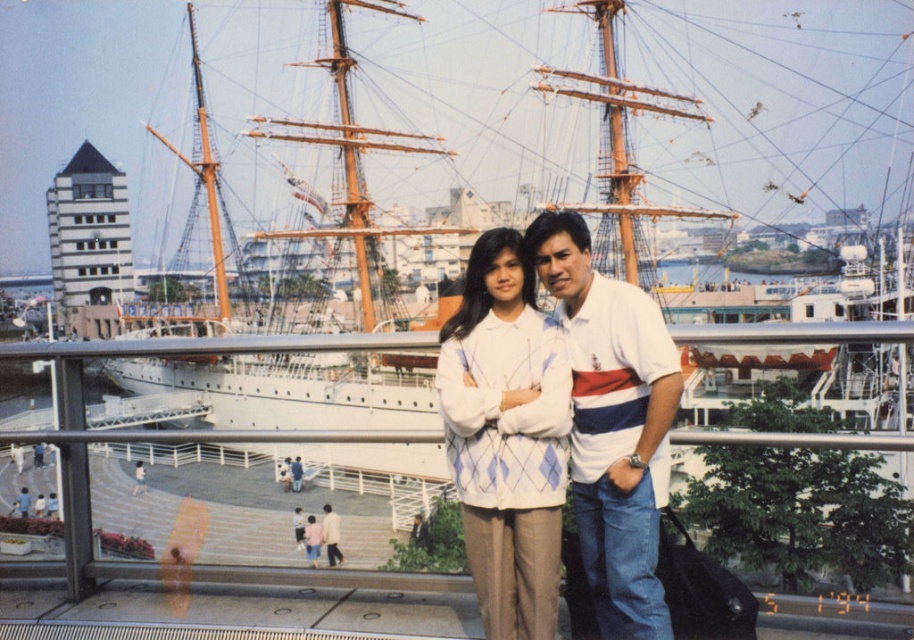
What do you see at coordinates (612, 422) in the screenshot? The image size is (914, 640). I see `white knitwear at center` at bounding box center [612, 422].

The width and height of the screenshot is (914, 640). Find the location of `white knitwear at center`. white knitwear at center is located at coordinates (612, 422).

Find the location of a particular element. white knitwear at center is located at coordinates (612, 422).